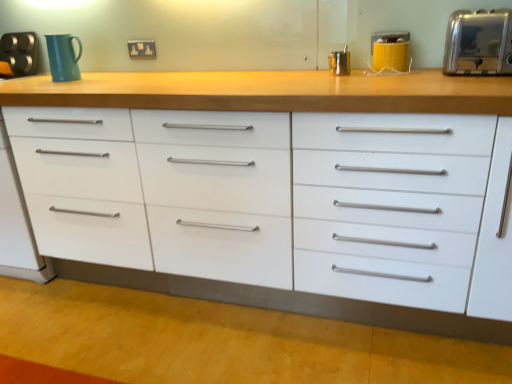
Question: Which direction should I rotate to face metallic silver container at upper center, the second appliance when ordered from left to right, — up or down?

Choices:
 (A) up
 (B) down

Answer: (A)

Question: Considering the relative sizes of satin silver toaster at upper right, which is the 4th appliance from left to right, and matte plastic electric outlet at upper center in the image provided, is satin silver toaster at upper right, which is the 4th appliance from left to right, bigger than matte plastic electric outlet at upper center?

Choices:
 (A) no
 (B) yes

Answer: (B)

Question: Considering the relative sizes of satin silver toaster at upper right, which is the first appliance from right to left, and matte plastic electric outlet at upper center in the image provided, is satin silver toaster at upper right, which is the first appliance from right to left, shorter than matte plastic electric outlet at upper center?

Choices:
 (A) no
 (B) yes

Answer: (A)

Question: Is satin silver toaster at upper right, the 1th appliance in the front-to-back sequence, at the right side of matte plastic electric outlet at upper center?

Choices:
 (A) yes
 (B) no

Answer: (A)

Question: Is there a large distance between satin silver toaster at upper right, which is the first appliance from right to left, and matte plastic electric outlet at upper center?

Choices:
 (A) yes
 (B) no

Answer: (A)

Question: Is satin silver toaster at upper right, which is the first appliance from right to left, behind matte plastic electric outlet at upper center?

Choices:
 (A) yes
 (B) no

Answer: (B)

Question: Is the surface of satin silver toaster at upper right, which is the 4th appliance from back to front, in direct contact with matte plastic electric outlet at upper center?

Choices:
 (A) no
 (B) yes

Answer: (A)

Question: Does yellow matte toaster at upper right, the third appliance when ordered from back to front, have a lesser width compared to satin silver toaster at upper right, which is the 4th appliance from left to right?

Choices:
 (A) yes
 (B) no

Answer: (A)

Question: Considering the relative positions of yellow matte toaster at upper right, the third appliance when ordered from back to front, and satin silver toaster at upper right, which is the 4th appliance from back to front, in the image provided, is yellow matte toaster at upper right, the third appliance when ordered from back to front, to the left of satin silver toaster at upper right, which is the 4th appliance from back to front, from the viewer's perspective?

Choices:
 (A) yes
 (B) no

Answer: (A)

Question: From the image's perspective, would you say yellow matte toaster at upper right, marked as the 3th appliance in a left-to-right arrangement, is shown under satin silver toaster at upper right, which is the 4th appliance from back to front?

Choices:
 (A) yes
 (B) no

Answer: (B)

Question: Is yellow matte toaster at upper right, the second appliance in the right-to-left sequence, shorter than satin silver toaster at upper right, which is the 4th appliance from left to right?

Choices:
 (A) no
 (B) yes

Answer: (B)

Question: Is yellow matte toaster at upper right, marked as the 3th appliance in a left-to-right arrangement, positioned beyond the bounds of satin silver toaster at upper right, which is the 4th appliance from back to front?

Choices:
 (A) no
 (B) yes

Answer: (B)

Question: From the image's perspective, is yellow matte toaster at upper right, which is the 2th appliance from front to back, located above satin silver toaster at upper right, which is the 4th appliance from left to right?

Choices:
 (A) no
 (B) yes

Answer: (B)

Question: Does matte plastic electric outlet at upper center have a smaller size compared to matte teal mug at upper left?

Choices:
 (A) no
 (B) yes

Answer: (B)